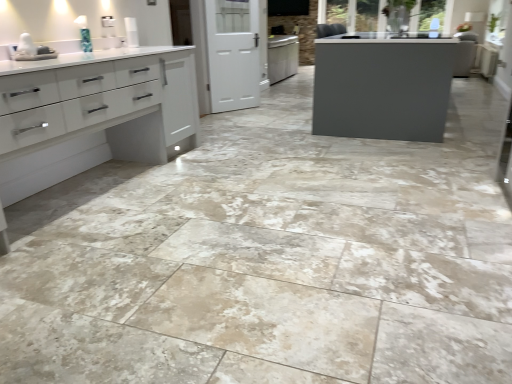
Where is `free location in front of white glossy cabinet at left`? The image size is (512, 384). free location in front of white glossy cabinet at left is located at coordinates (134, 266).